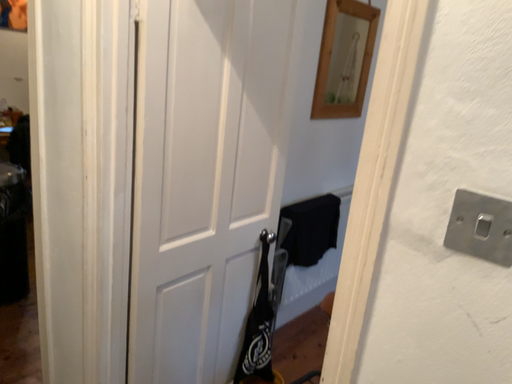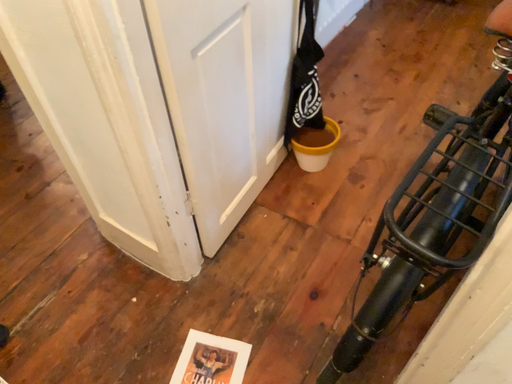
Question: How did the camera likely rotate when shooting the video?

Choices:
 (A) rotated upward
 (B) rotated downward

Answer: (B)